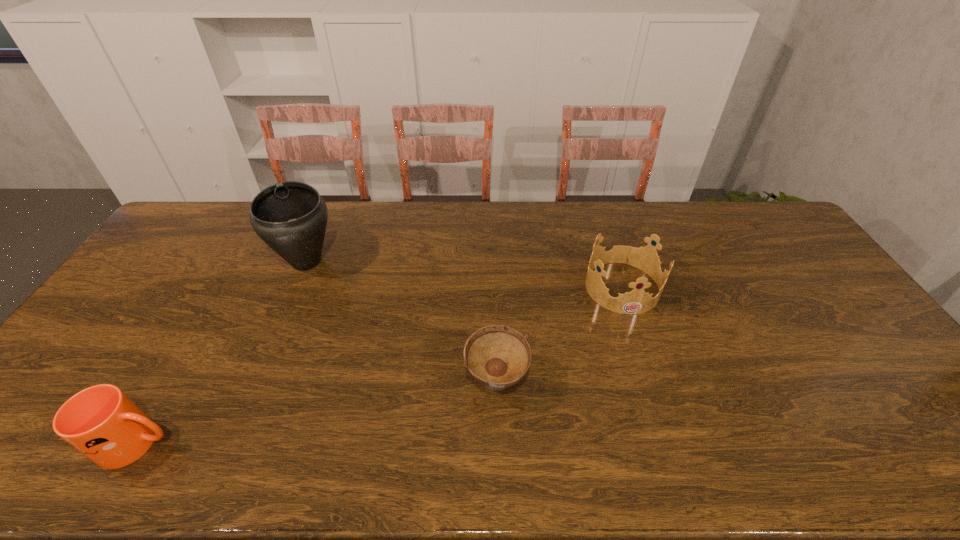
This screenshot has width=960, height=540. In order to click on the third object from right to left in this screenshot , I will do `click(290, 217)`.

You are a GUI agent. You are given a task and a screenshot of the screen. Output one action in this format:
    pyautogui.click(x=<x>, y=<y>)
    Task: Click on the urn
    The image size is (960, 540).
    Given the screenshot: What is the action you would take?
    pyautogui.click(x=290, y=217)

Locate an element on the screen. The height and width of the screenshot is (540, 960). tiara is located at coordinates (637, 301).

At what (x,y) coordinates should I click in order to perform the action: click on mug. Please return your answer as a coordinate pair (x, y). Image resolution: width=960 pixels, height=540 pixels. Looking at the image, I should click on (101, 422).

At what (x,y) coordinates should I click in order to perform the action: click on the leftmost object. Please return your answer as a coordinate pair (x, y). The image size is (960, 540). Looking at the image, I should click on (101, 422).

Where is `the third object from left to right`? The width and height of the screenshot is (960, 540). the third object from left to right is located at coordinates (497, 356).

Identify the location of soup bowl. The image size is (960, 540). (497, 356).

Find the location of `vacant space located on the front of the tallest object`. vacant space located on the front of the tallest object is located at coordinates (259, 374).

Where is `vacant space located on the front-facing side of the rightmost object`? The height and width of the screenshot is (540, 960). vacant space located on the front-facing side of the rightmost object is located at coordinates pyautogui.click(x=661, y=407).

Image resolution: width=960 pixels, height=540 pixels. I want to click on vacant space located on the handle side of the mug, so click(x=295, y=443).